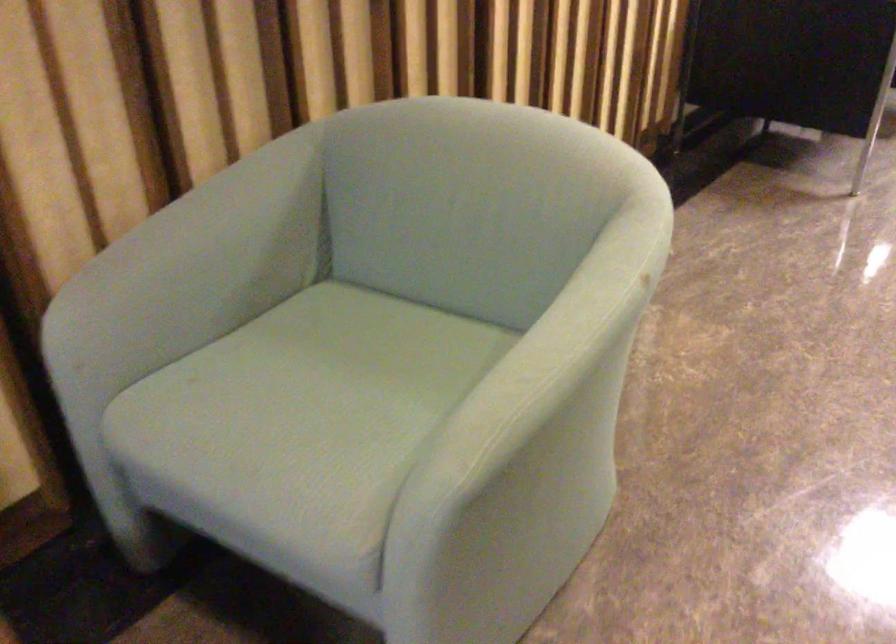
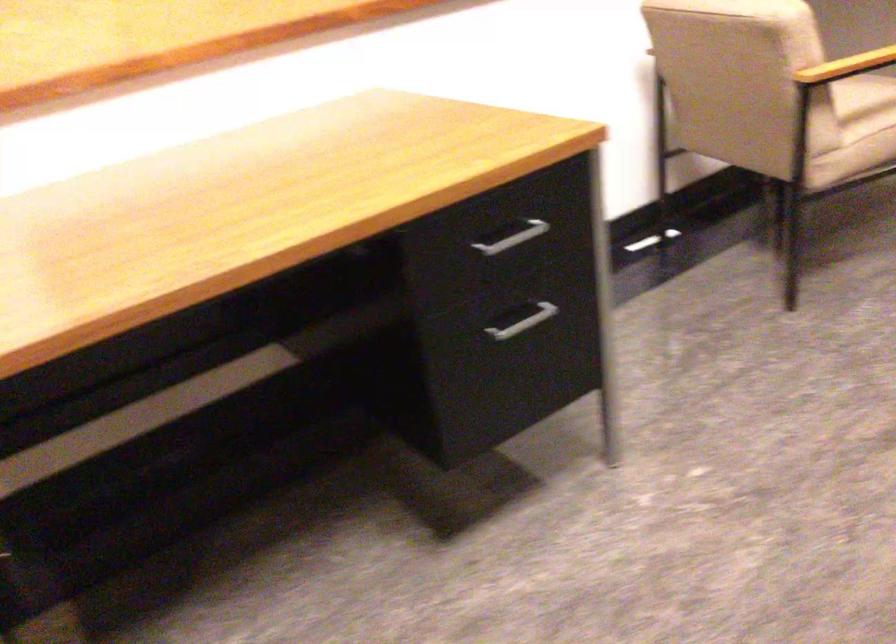
In a continuous first-person perspective shot, in which direction is the camera moving?

The cameraman moved toward right, forward.